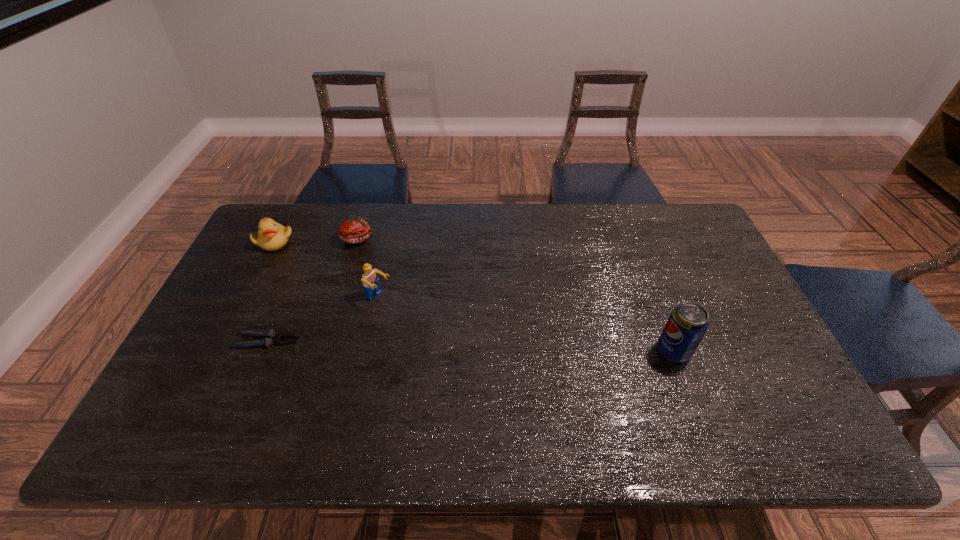
Locate an element on the screen. This screenshot has height=540, width=960. pliers that is at the left edge is located at coordinates click(x=270, y=337).

At what (x,y) coordinates should I click in order to perform the action: click on duckling located in the left edge section of the desktop. Please return your answer as a coordinate pair (x, y). Image resolution: width=960 pixels, height=540 pixels. Looking at the image, I should click on (271, 236).

This screenshot has height=540, width=960. I want to click on object situated at the far left corner, so click(x=271, y=236).

Locate an element on the screen. The image size is (960, 540). vacant space at the far edge of the desktop is located at coordinates (380, 205).

Where is `vacant region at the near edge`? vacant region at the near edge is located at coordinates (519, 380).

This screenshot has height=540, width=960. I want to click on vacant area at the left edge, so click(x=246, y=272).

The image size is (960, 540). In order to click on vacant region at the right edge in this screenshot , I will do `click(756, 369)`.

Where is `vacant area at the far left corner`? Image resolution: width=960 pixels, height=540 pixels. vacant area at the far left corner is located at coordinates (305, 218).

Identify the location of free space at the far right corner of the desktop. The height and width of the screenshot is (540, 960). (656, 227).

The width and height of the screenshot is (960, 540). I want to click on vacant region between the tomato and the tallest object, so click(516, 295).